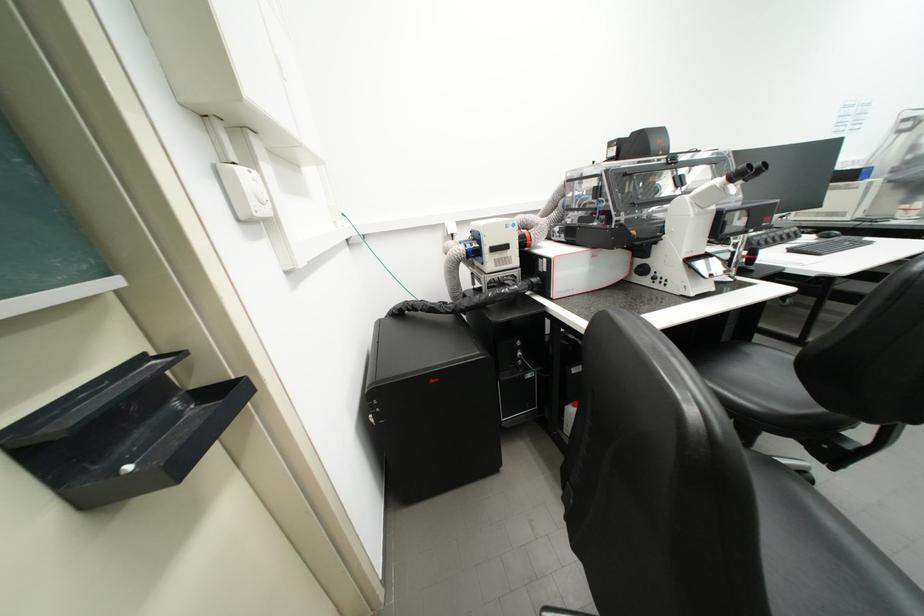
What do you see at coordinates (759, 169) in the screenshot? The height and width of the screenshot is (616, 924). I see `a microscope eyepieces` at bounding box center [759, 169].